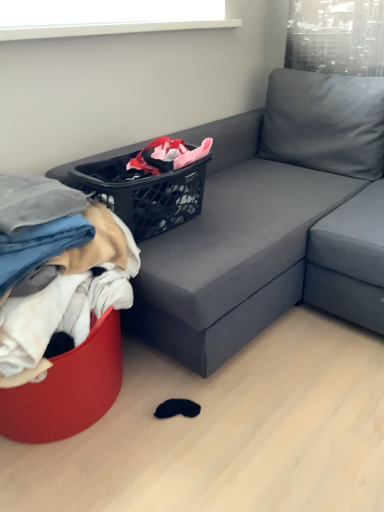
Based on the photo, in order to face soft cotton clothes at left, arranged as the second clothing when viewed from the top, should I rotate leftwards or rightwards?

You should look left and rotate roughly 19.022 degrees.

What is the approximate height of denim fabric pants at lower left, which appears as the first clothing when viewed from the top?

It is 7.55 inches.

This screenshot has height=512, width=384. I want to click on black plastic basket at upper center, so click(145, 193).

Considering the sizes of objects matte gray couch at center and black plastic basket at upper center in the image provided, who is wider, matte gray couch at center or black plastic basket at upper center?

matte gray couch at center is wider.

From the image's perspective, which is below, matte gray couch at center or black plastic basket at upper center?

matte gray couch at center.

How much distance is there between matte gray couch at center and black plastic basket at upper center?

A distance of 14.49 inches exists between matte gray couch at center and black plastic basket at upper center.

Which is in front, matte gray couch at center or black plastic basket at upper center?

matte gray couch at center.

Considering the positions of objects black plastic basket at upper center and soft cotton clothes at left, marked as the 1th clothing in a bottom-to-top arrangement, in the image provided, who is in front, black plastic basket at upper center or soft cotton clothes at left, marked as the 1th clothing in a bottom-to-top arrangement,?

soft cotton clothes at left, marked as the 1th clothing in a bottom-to-top arrangement, is more forward.

In the image, is black plastic basket at upper center on the left side or the right side of soft cotton clothes at left, marked as the 1th clothing in a bottom-to-top arrangement?

black plastic basket at upper center is to the right of soft cotton clothes at left, marked as the 1th clothing in a bottom-to-top arrangement.

Can you confirm if black plastic basket at upper center is wider than soft cotton clothes at left, arranged as the second clothing when viewed from the top?

In fact, black plastic basket at upper center might be narrower than soft cotton clothes at left, arranged as the second clothing when viewed from the top.

Is black plastic basket at upper center not inside soft cotton clothes at left, marked as the 1th clothing in a bottom-to-top arrangement?

That's correct, black plastic basket at upper center is outside of soft cotton clothes at left, marked as the 1th clothing in a bottom-to-top arrangement.

From a real-world perspective, is soft cotton clothes at left, marked as the 1th clothing in a bottom-to-top arrangement, under black plastic basket at upper center?

Yes, from a real-world perspective, soft cotton clothes at left, marked as the 1th clothing in a bottom-to-top arrangement, is below black plastic basket at upper center.

Find the location of a particular element. This screenshot has height=512, width=384. basket above the soft cotton clothes at left, marked as the 1th clothing in a bottom-to-top arrangement (from a real-world perspective) is located at coordinates (145, 193).

From the image's perspective, is soft cotton clothes at left, arranged as the second clothing when viewed from the top, located above black plastic basket at upper center?

Actually, soft cotton clothes at left, arranged as the second clothing when viewed from the top, appears below black plastic basket at upper center in the image.

Considering the relative positions of soft cotton clothes at left, arranged as the second clothing when viewed from the top, and black plastic basket at upper center in the image provided, is soft cotton clothes at left, arranged as the second clothing when viewed from the top, to the left of black plastic basket at upper center from the viewer's perspective?

Indeed, soft cotton clothes at left, arranged as the second clothing when viewed from the top, is positioned on the left side of black plastic basket at upper center.

How much distance is there between matte gray couch at center and denim fabric pants at lower left, the 2th clothing when ordered from bottom to top?

A distance of 30.30 inches exists between matte gray couch at center and denim fabric pants at lower left, the 2th clothing when ordered from bottom to top.

From the image's perspective, is matte gray couch at center above or below denim fabric pants at lower left, the 2th clothing when ordered from bottom to top?

matte gray couch at center is situated higher than denim fabric pants at lower left, the 2th clothing when ordered from bottom to top, in the image.

In terms of height, does matte gray couch at center look taller or shorter compared to denim fabric pants at lower left, which appears as the first clothing when viewed from the top?

In the image, matte gray couch at center appears to be taller than denim fabric pants at lower left, which appears as the first clothing when viewed from the top.

Considering the sizes of objects matte gray couch at center and denim fabric pants at lower left, the 2th clothing when ordered from bottom to top, in the image provided, who is thinner, matte gray couch at center or denim fabric pants at lower left, the 2th clothing when ordered from bottom to top,?

denim fabric pants at lower left, the 2th clothing when ordered from bottom to top.

Based on the photo, based on their positions, is black plastic basket at upper center located to the left or right of matte gray couch at center?

Clearly, black plastic basket at upper center is on the left of matte gray couch at center in the image.

Is black plastic basket at upper center looking in the opposite direction of matte gray couch at center?

Yes, matte gray couch at center is at the back of black plastic basket at upper center.

Can we say black plastic basket at upper center lies outside matte gray couch at center?

No, black plastic basket at upper center is not entirely external to matte gray couch at center.

From the image's perspective, between black plastic basket at upper center and matte gray couch at center, who is located below?

matte gray couch at center is shown below in the image.

Considering the positions of point (33, 253) and point (185, 208), is point (33, 253) closer or farther from the camera than point (185, 208)?

Point (33, 253) is closer to the camera than point (185, 208).

Can you confirm if denim fabric pants at lower left, which appears as the first clothing when viewed from the top, is positioned to the left of black plastic basket at upper center?

Correct, you'll find denim fabric pants at lower left, which appears as the first clothing when viewed from the top, to the left of black plastic basket at upper center.

In the scene shown: Would you say denim fabric pants at lower left, which appears as the first clothing when viewed from the top, is inside or outside black plastic basket at upper center?

denim fabric pants at lower left, which appears as the first clothing when viewed from the top, exists outside the volume of black plastic basket at upper center.

Does denim fabric pants at lower left, the 2th clothing when ordered from bottom to top, come in front of black plastic basket at upper center?

Yes, it is in front of black plastic basket at upper center.

From a real-world perspective, which object rests below the other?

In real-world perspective, denim fabric pants at lower left, the 2th clothing when ordered from bottom to top, is lower.

Between point (170, 196) and point (39, 251), which one is positioned in front?

The point (39, 251) is in front.

From the image's perspective, between black plastic basket at upper center and denim fabric pants at lower left, which appears as the first clothing when viewed from the top, which one is located above?

black plastic basket at upper center appears higher in the image.

Locate an element on the screen. Image resolution: width=384 pixels, height=512 pixels. basket that appears on the right of denim fabric pants at lower left, the 2th clothing when ordered from bottom to top is located at coordinates (145, 193).

Find the location of `basket above the matte gray couch at center (from the image's perspective)`. basket above the matte gray couch at center (from the image's perspective) is located at coordinates (145, 193).

From the image's perspective, which clothing is the 2nd one below the black plastic basket at upper center? Please provide its 2D coordinates.

[(64, 308)]

Based on their spatial positions, is denim fabric pants at lower left, the 2th clothing when ordered from bottom to top, or black plastic basket at upper center further from matte gray couch at center?

denim fabric pants at lower left, the 2th clothing when ordered from bottom to top, lies further to matte gray couch at center than the other object.

Based on their spatial positions, is denim fabric pants at lower left, which appears as the first clothing when viewed from the top, or soft cotton clothes at left, arranged as the second clothing when viewed from the top, closer to black plastic basket at upper center?

soft cotton clothes at left, arranged as the second clothing when viewed from the top, is closer to black plastic basket at upper center.

From the image, which object appears to be nearer to black plastic basket at upper center, denim fabric pants at lower left, the 2th clothing when ordered from bottom to top, or matte gray couch at center?

The object closer to black plastic basket at upper center is denim fabric pants at lower left, the 2th clothing when ordered from bottom to top.

Based on their spatial positions, is black plastic basket at upper center or matte gray couch at center closer to denim fabric pants at lower left, the 2th clothing when ordered from bottom to top?

The object closer to denim fabric pants at lower left, the 2th clothing when ordered from bottom to top, is black plastic basket at upper center.

Looking at the image, which one is located closer to soft cotton clothes at left, marked as the 1th clothing in a bottom-to-top arrangement, denim fabric pants at lower left, which appears as the first clothing when viewed from the top, or matte gray couch at center?

denim fabric pants at lower left, which appears as the first clothing when viewed from the top.

Consider the image. When comparing their distances from matte gray couch at center, does soft cotton clothes at left, marked as the 1th clothing in a bottom-to-top arrangement, or black plastic basket at upper center seem closer?

black plastic basket at upper center lies closer to matte gray couch at center than the other object.

When comparing their distances from matte gray couch at center, does soft cotton clothes at left, arranged as the second clothing when viewed from the top, or denim fabric pants at lower left, the 2th clothing when ordered from bottom to top, seem further?

The object further to matte gray couch at center is denim fabric pants at lower left, the 2th clothing when ordered from bottom to top.

Considering their positions, is denim fabric pants at lower left, the 2th clothing when ordered from bottom to top, positioned further to soft cotton clothes at left, arranged as the second clothing when viewed from the top, than black plastic basket at upper center?

black plastic basket at upper center.

This screenshot has width=384, height=512. Identify the location of clothing between denim fabric pants at lower left, the 2th clothing when ordered from bottom to top, and matte gray couch at center from left to right. (64, 308).

This screenshot has width=384, height=512. Identify the location of basket between soft cotton clothes at left, marked as the 1th clothing in a bottom-to-top arrangement, and matte gray couch at center from left to right. (145, 193).

Locate an element on the screen. This screenshot has width=384, height=512. clothing between soft cotton clothes at left, arranged as the second clothing when viewed from the top, and black plastic basket at upper center, along the z-axis is located at coordinates (39, 246).

The height and width of the screenshot is (512, 384). I want to click on basket between denim fabric pants at lower left, the 2th clothing when ordered from bottom to top, and matte gray couch at center, so click(x=145, y=193).